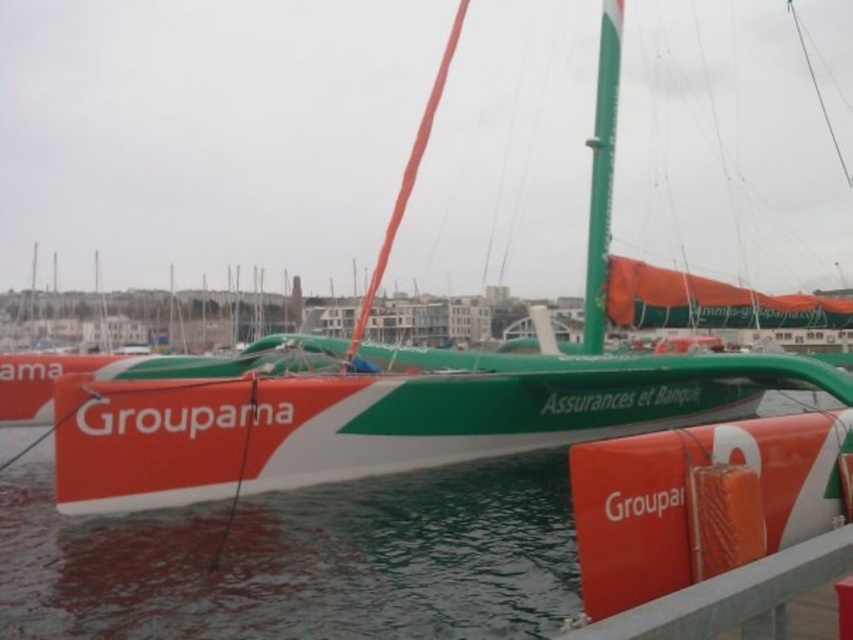
You are a sailor on the Groupama catamaran and need to mark a specific point on your map. The point is located at coordinates point (x=21, y=566). According to the image, what is the color of the area where this point is located?

The point (x=21, y=566) is on green matte water at center, so the area is green.

Consider the image. You are standing on the deck of the catamaran and see the green matte water at center and the orange matte rail at lower right. Which object is closer to the deck?

The orange matte rail at lower right is closer to the deck because it is above the green matte water at center.